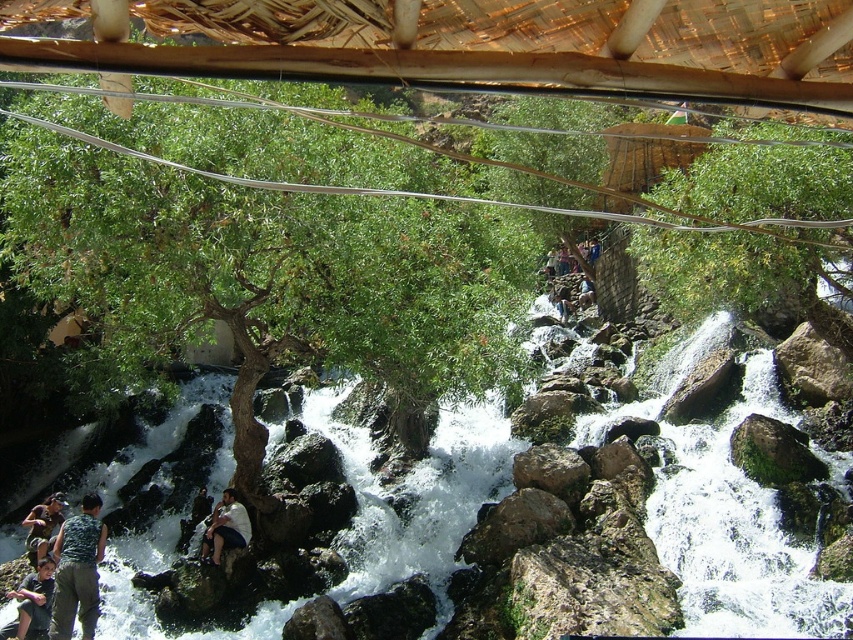
You are a photographer aiming to capture a group photo of the dark green fabric shirt at lower left and the camouflage fabric person at lower left. Since you want to include both in the frame, which one should you position closer to the center of the photo to ensure both are visible?

You should position the camouflage fabric person at lower left closer to the center of the photo because the dark green fabric shirt at lower left is to the right of the camouflage fabric person at lower left, so moving the camouflage fabric person at lower left towards the center will help include both in the frame.

You are standing at the base of the waterfall and want to reach a specific spot. There are two points marked in the scene. One is at coordinates point (165,340) and the other is at point (45,570). Which point is closer to you?

Point (45,570) is closer to you because it is in front of point (165,340).